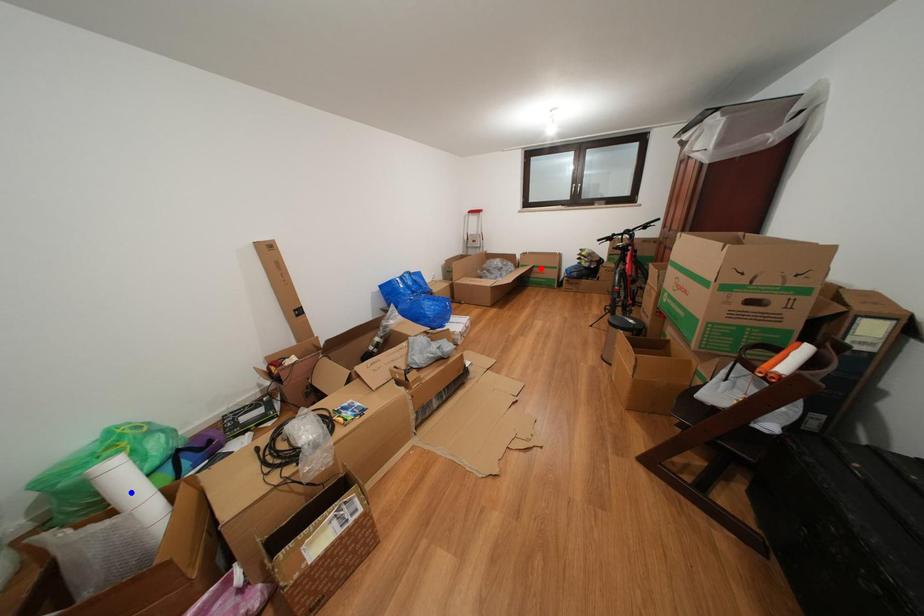
Question: Which of the two points in the image is closer to the camera?

Choices:
 (A) Blue point is closer.
 (B) Red point is closer.

Answer: (A)